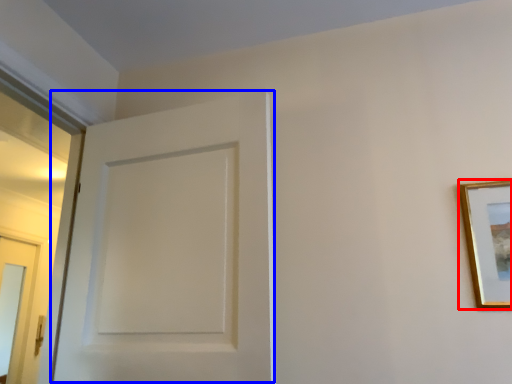
Question: Among these objects, which one is nearest to the camera, picture frame (highlighted by a red box) or door (highlighted by a blue box)?

Choices:
 (A) picture frame
 (B) door

Answer: (B)